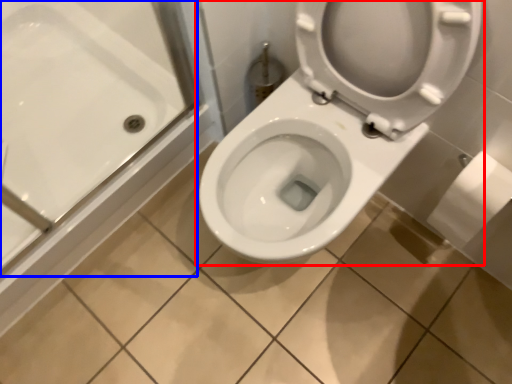
Question: Which object is closer to the camera taking this photo, toilet (highlighted by a red box) or bath (highlighted by a blue box)?

Choices:
 (A) toilet
 (B) bath

Answer: (A)